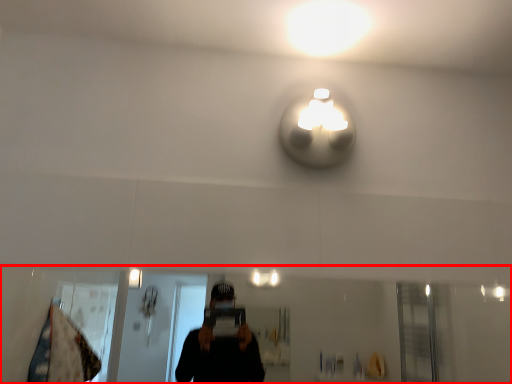
Question: Considering the relative positions of mirror (annotated by the red box) and light in the image provided, where is mirror (annotated by the red box) located with respect to the staircase?

Choices:
 (A) right
 (B) left

Answer: (B)